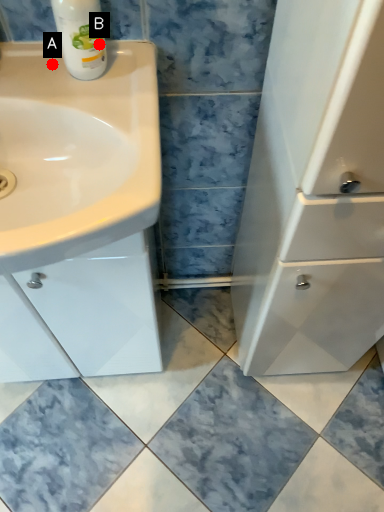
Question: Two points are circled on the image, labeled by A and B beside each circle. Among these points, which one is nearest to the camera?

Choices:
 (A) A is closer
 (B) B is closer

Answer: (B)